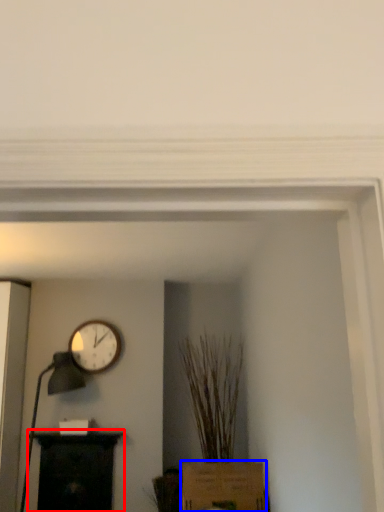
Question: Which point is further to the camera, furniture (highlighted by a red box) or cardboard box (highlighted by a blue box)?

Choices:
 (A) furniture
 (B) cardboard box

Answer: (A)